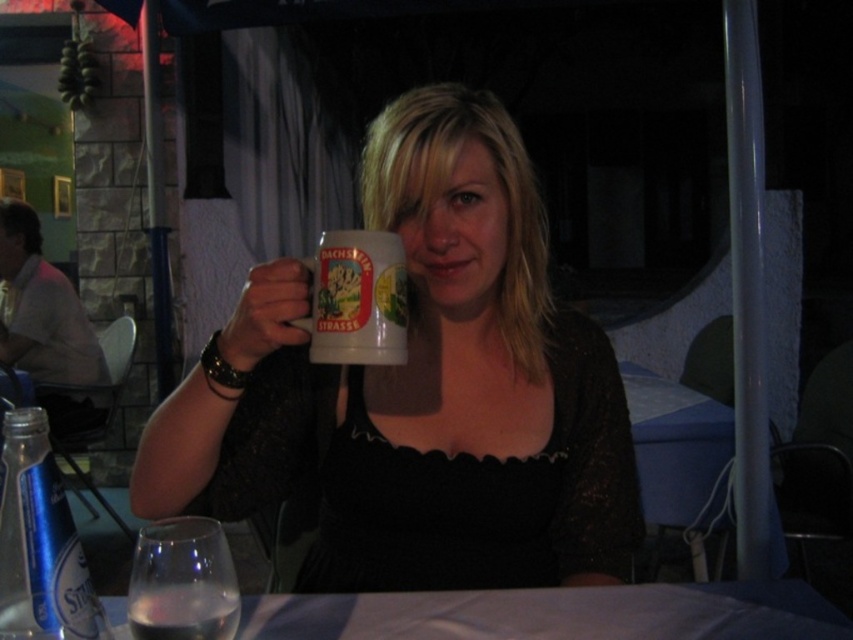
Question: Is white ceramic mug at center positioned in front of clear liquid at lower left?

Choices:
 (A) no
 (B) yes

Answer: (A)

Question: Which object is farther from the camera taking this photo?

Choices:
 (A) clear liquid at lower left
 (B) matte ceramic mug at center
 (C) white ceramic mug at center
 (D) white cloth table at center

Answer: (B)

Question: Which of the following is the farthest from the observer?

Choices:
 (A) matte ceramic mug at center
 (B) transparent glass at lower left

Answer: (A)

Question: In this image, where is matte ceramic mug at center located relative to white cloth table at center?

Choices:
 (A) right
 (B) left

Answer: (B)

Question: Observing the image, what is the correct spatial positioning of white cloth table at center in reference to white ceramic mug at center?

Choices:
 (A) above
 (B) below

Answer: (B)

Question: Among these objects, which one is nearest to the camera?

Choices:
 (A) clear liquid at lower left
 (B) white ceramic mug at center
 (C) matte ceramic mug at center
 (D) white cloth table at center

Answer: (A)